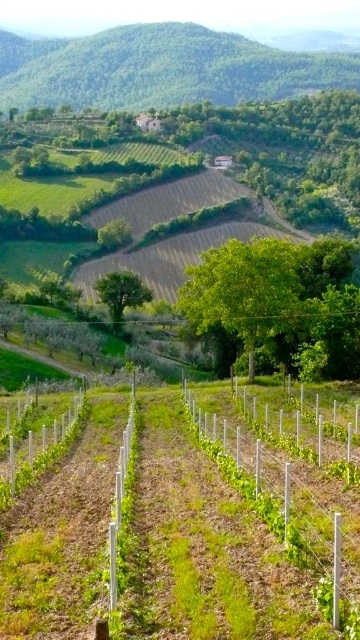
You are standing at the bottom of the vineyard and looking up towards the hills. There is a point marked at coordinates (160,68). What does this point represent?

The point at (160,68) represents the green leafy hillside at upper center.

You are a farmer checking the elevation of your vineyard. You notice the green leafy hillside at upper center and the green grassy row at center. Which one is higher in elevation?

The green leafy hillside at upper center is much taller than the green grassy row at center, so it has a higher elevation.